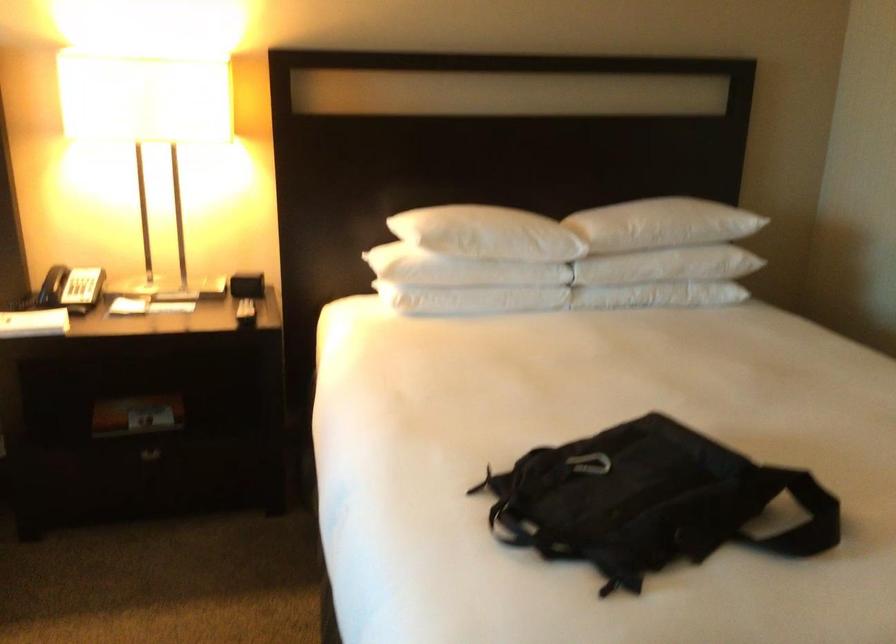
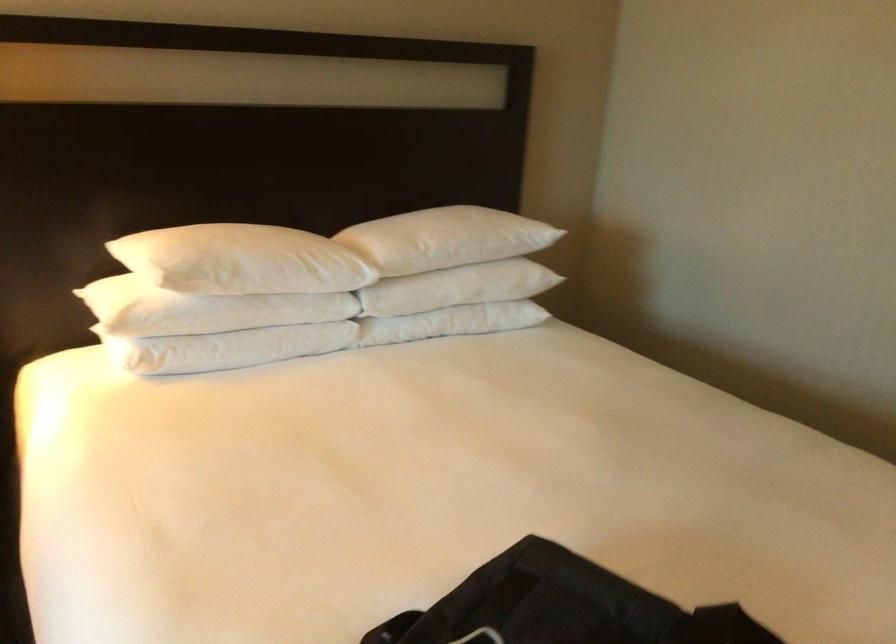
In the second image, find the point that corresponds to [653,290] in the first image.

(451, 322)